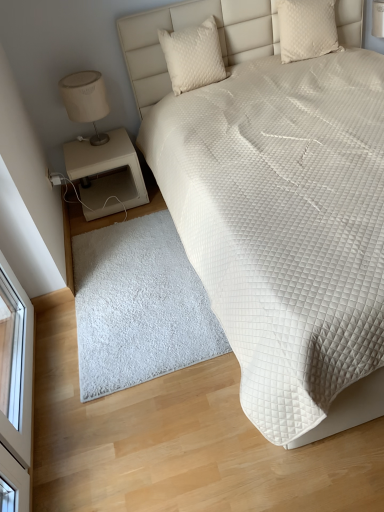
What are the coordinates of `free space above white fluffy rug at lower center (from a real-world perspective)` in the screenshot? It's located at (131, 282).